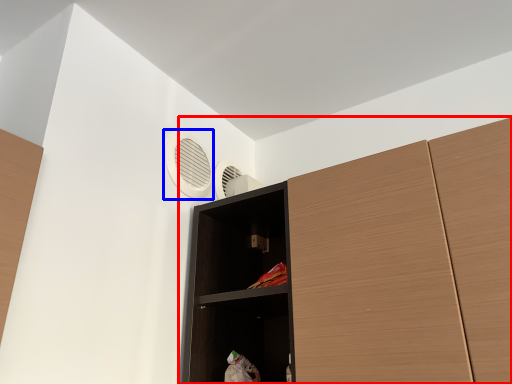
Question: Which of the following is the closest to the observer, cupboard (highlighted by a red box) or air conditioning (highlighted by a blue box)?

Choices:
 (A) cupboard
 (B) air conditioning

Answer: (A)